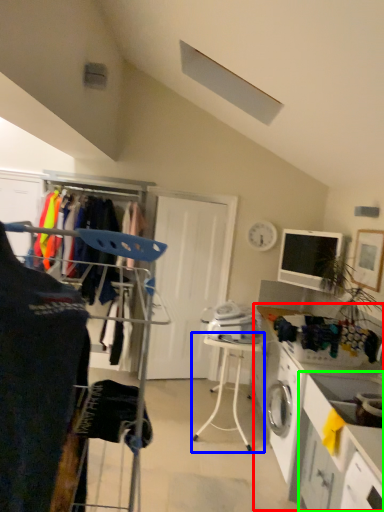
Question: Considering the real-world distances, which object is farthest from counter (highlighted by a red box)? table (highlighted by a blue box) or counter (highlighted by a green box)?

Choices:
 (A) table
 (B) counter

Answer: (A)